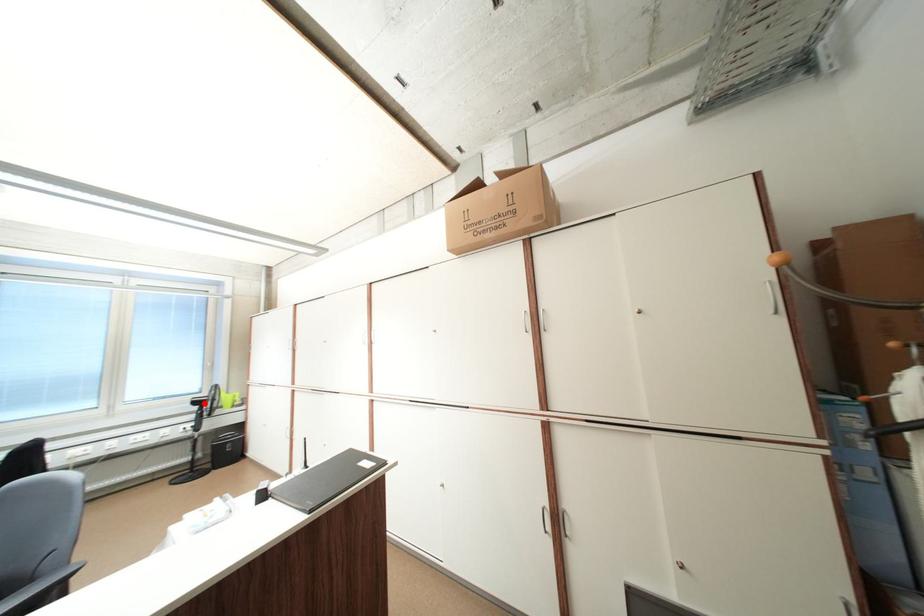
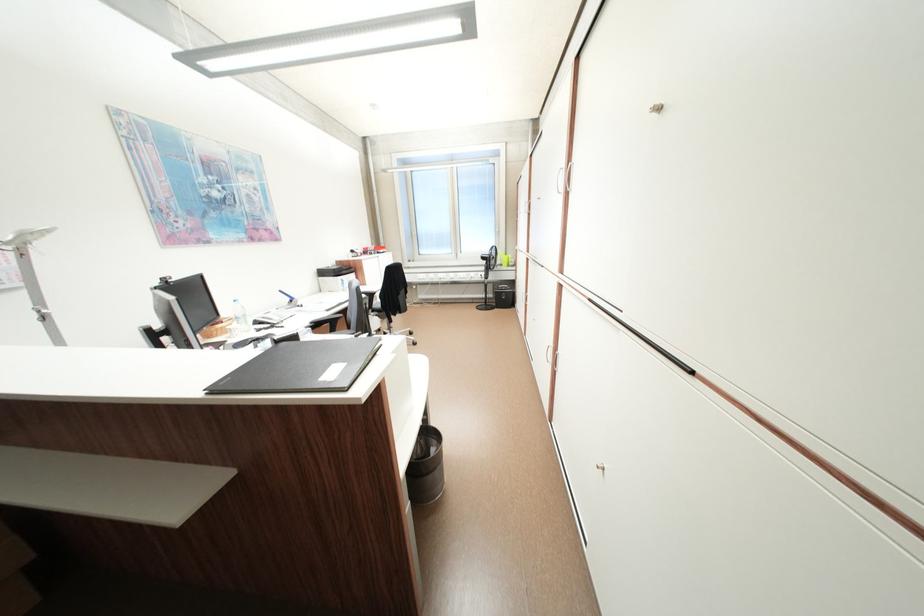
Question: I am providing you with two images of the same scene from different viewpoints. Given a red point in image1, look at the same physical point in image2. Is it:

Choices:
 (A) Closer to the viewpoint
 (B) Farther from the viewpoint

Answer: (A)